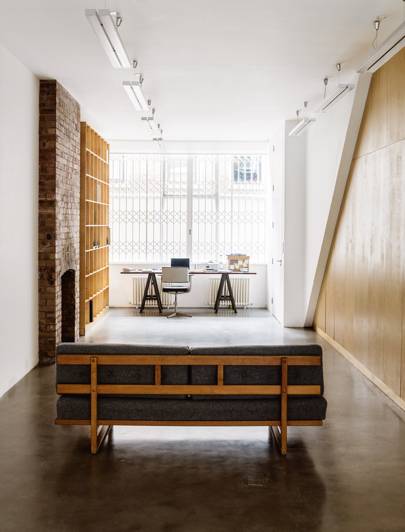
The width and height of the screenshot is (405, 532). Find the location of `desk`. desk is located at coordinates (196, 273).